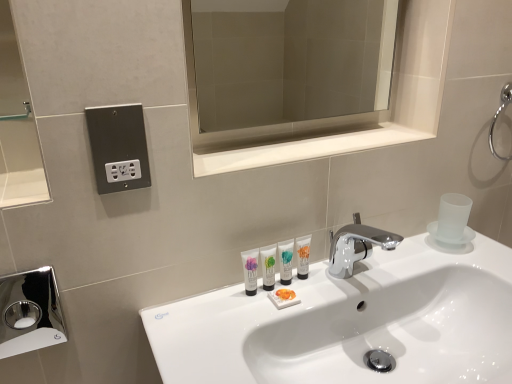
What are the coordinates of `vacant space to the right of white glossy tube at center, which is counted as the second mouthwash, starting from the right` in the screenshot? It's located at (346, 283).